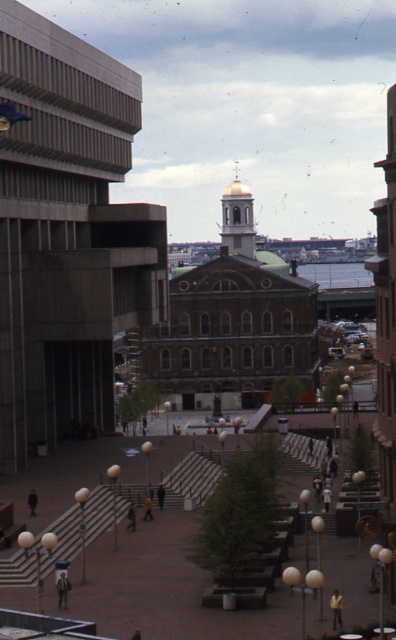
Is concrete building at left above gold dome at center?

Actually, concrete building at left is below gold dome at center.

How far apart are concrete building at left and gold dome at center?

The distance of concrete building at left from gold dome at center is 64.90 meters.

Find the location of a particular element. concrete building at left is located at coordinates (66, 234).

Locate an element on the screen. This screenshot has height=640, width=396. concrete building at left is located at coordinates (66, 234).